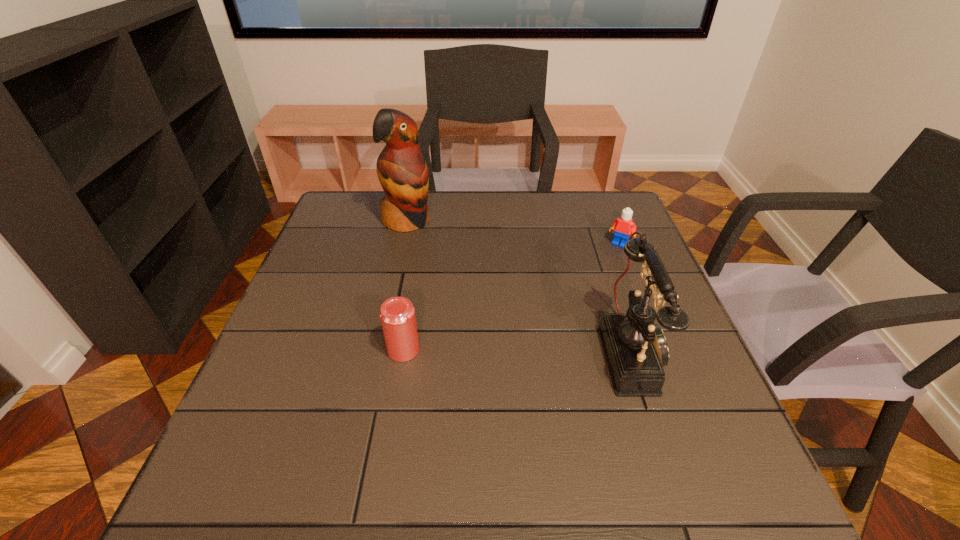
You are a GUI agent. You are given a task and a screenshot of the screen. Output one action in this format:
    pyautogui.click(x=<x>, y=<y>)
    Task: Click on the free space at the left edge of the desktop
    
    Given the screenshot: What is the action you would take?
    pyautogui.click(x=331, y=290)

The height and width of the screenshot is (540, 960). In order to click on free spot at the right edge of the desktop in this screenshot , I will do `click(600, 236)`.

Identify the location of vacant region at the far right corner of the desktop. (601, 213).

Where is `vacant space at the near right corner of the desktop`? The width and height of the screenshot is (960, 540). vacant space at the near right corner of the desktop is located at coordinates (661, 441).

This screenshot has height=540, width=960. Identify the location of empty space between the Lego and the farthest object. (514, 233).

Where is `vacant area between the telephone and the third nearest object`? The height and width of the screenshot is (540, 960). vacant area between the telephone and the third nearest object is located at coordinates (626, 298).

Find the location of a particular element. vacant area between the farthest object and the third nearest object is located at coordinates (514, 233).

You are a GUI agent. You are given a task and a screenshot of the screen. Output one action in this format:
    pyautogui.click(x=<x>, y=<y>)
    Task: Click on the free spot between the tallest object and the Lego
    The width and height of the screenshot is (960, 540).
    Given the screenshot: What is the action you would take?
    pyautogui.click(x=514, y=233)

Find the location of `vacant space that's between the farthest object and the telephone`. vacant space that's between the farthest object and the telephone is located at coordinates (519, 286).

You are a GUI agent. You are given a task and a screenshot of the screen. Output one action in this format:
    pyautogui.click(x=<x>, y=<y>)
    Task: Click on the unoccupied area between the beer can and the tallest object
    Image resolution: width=960 pixels, height=540 pixels.
    Given the screenshot: What is the action you would take?
    pyautogui.click(x=405, y=286)